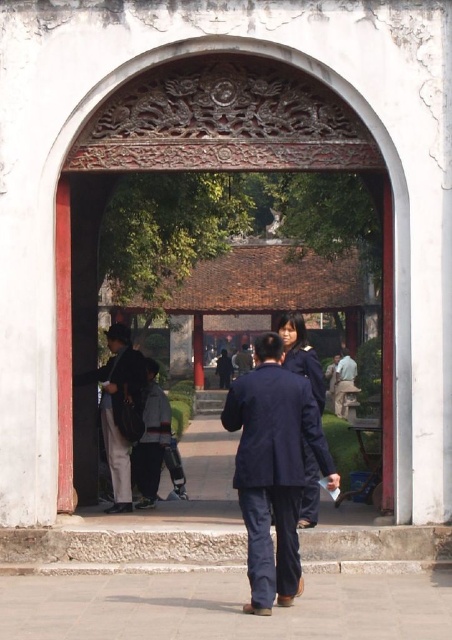
You are a photographer standing in front of the traditional Chinese archway. You notice a navy blue suit at center and a light brown leather jacket at center. Which clothing item would appear bigger in your photo?

The navy blue suit at center is larger in size than the light brown leather jacket at center, so it would appear bigger in the photo.

You are standing in front of the traditional Chinese archway and notice two items hanging on a rack at the center. Which item is closer to the ground, the light brown leather jacket at center or the dark blue uniform at center?

The light brown leather jacket at center is positioned under the dark blue uniform at center, so the light brown leather jacket at center is closer to the ground.